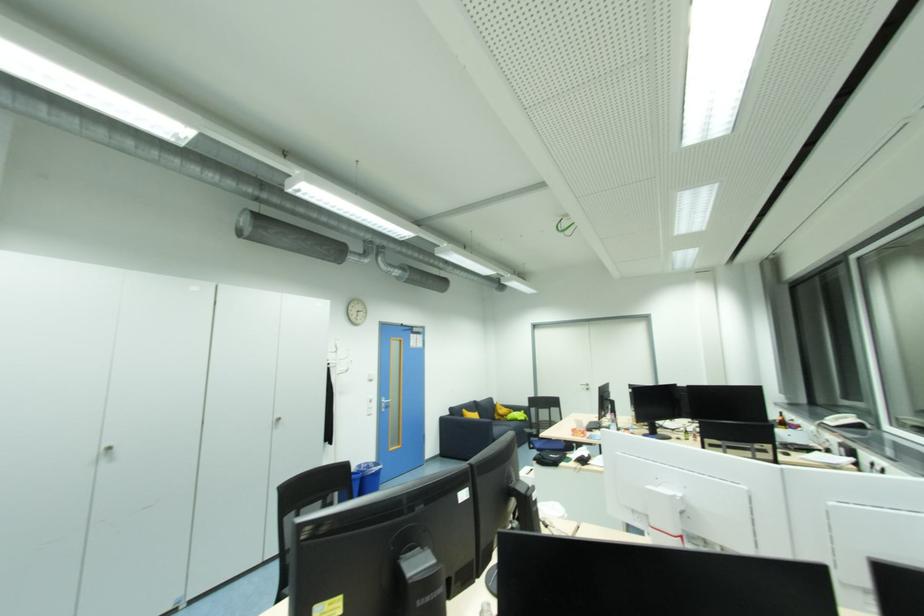
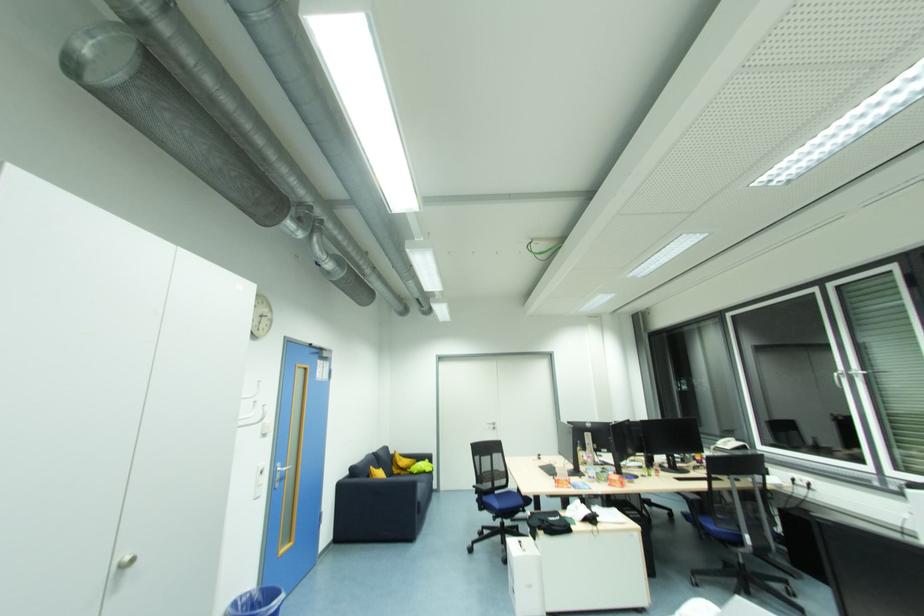
Find the pixel in the second image that matches (x=500, y=418) in the first image.

(398, 472)